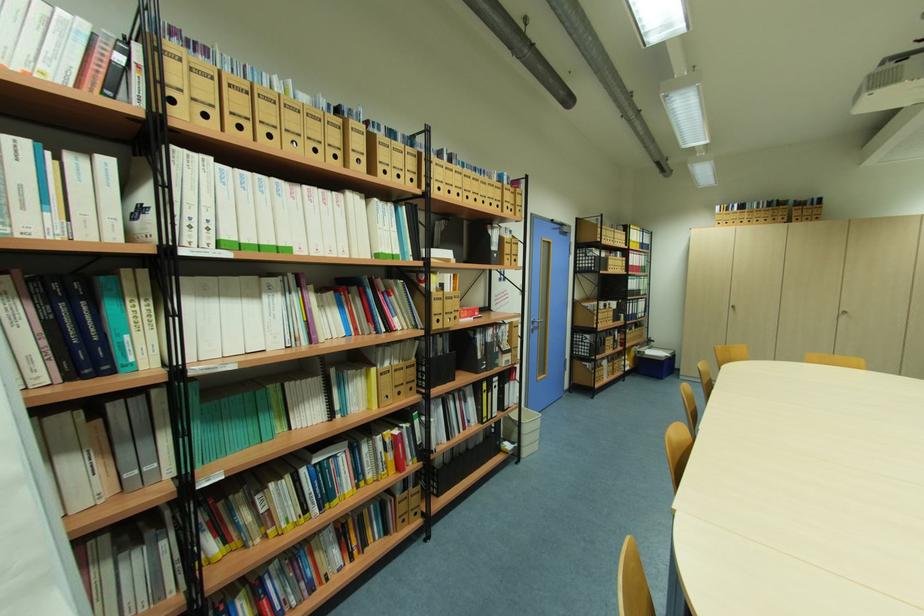
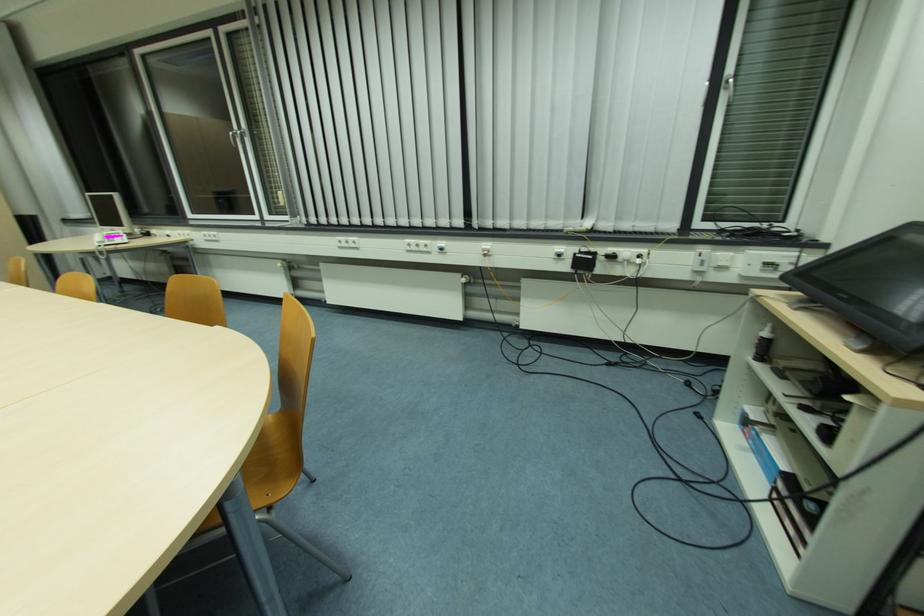
Based on the continuous images, in which direction is the camera rotating?

The camera rotated toward right-down.